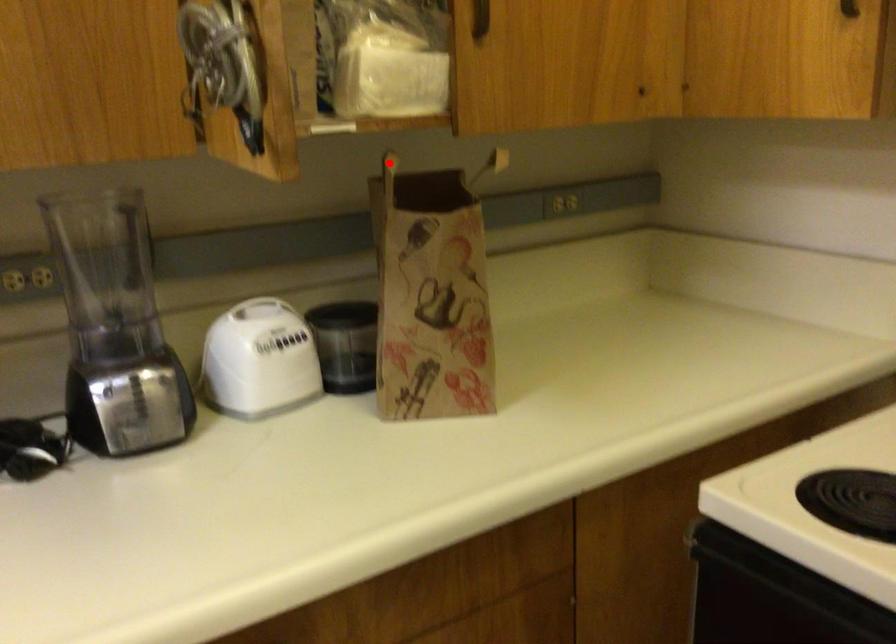
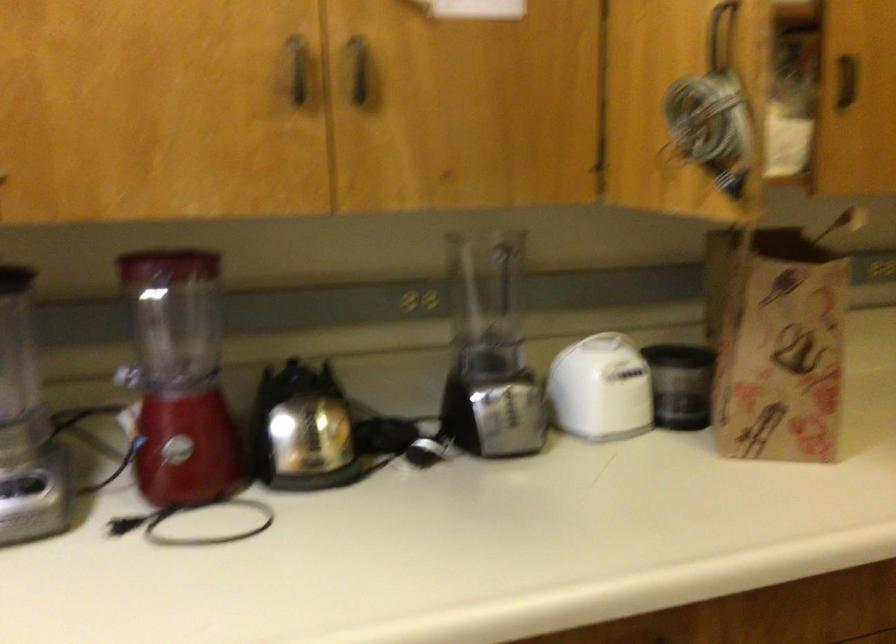
Question: I am providing you with two images of the same scene from different viewpoints. A red point is marked on the first image. Is the red point's position out of view in image 2?

Choices:
 (A) Yes
 (B) No

Answer: (B)